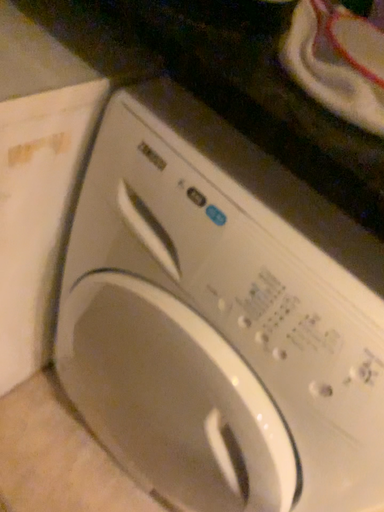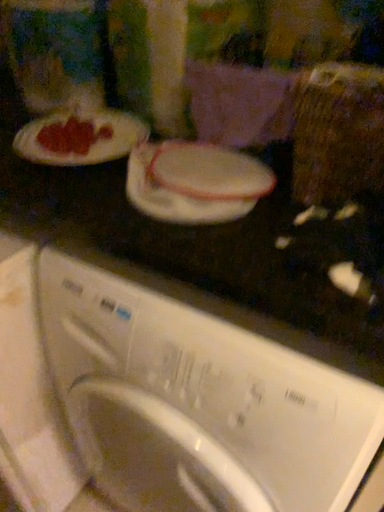
Question: Which way did the camera rotate in the video?

Choices:
 (A) rotated downward
 (B) rotated upward

Answer: (B)